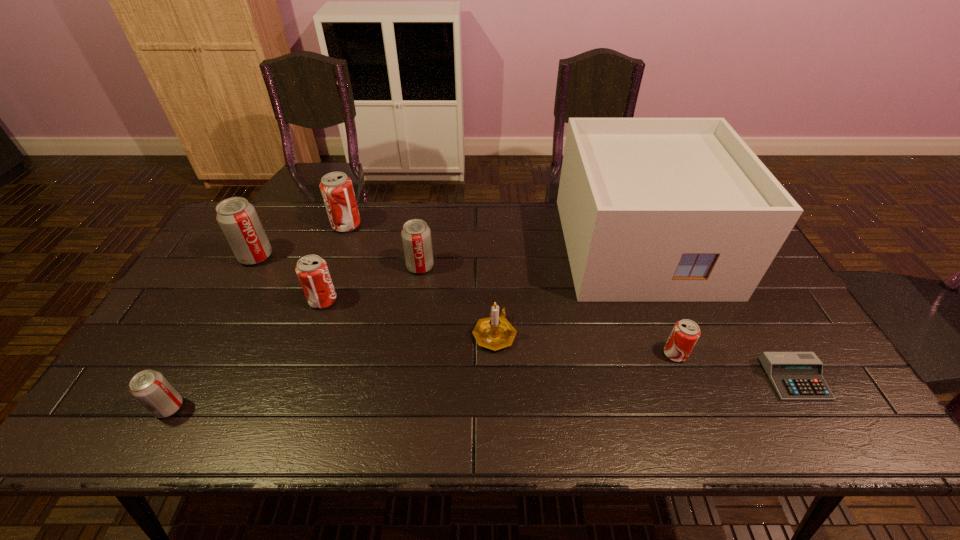
Where is `object that is at the far left corner`? This screenshot has height=540, width=960. object that is at the far left corner is located at coordinates (237, 218).

Identify the location of object that is at the near left corner. (150, 388).

The height and width of the screenshot is (540, 960). What are the coordinates of `object that is at the far right corner` in the screenshot? It's located at (652, 209).

Image resolution: width=960 pixels, height=540 pixels. In the image, there is a desktop. Identify the location of vacant space at the far edge. (388, 205).

What are the coordinates of `free region at the near edge` in the screenshot? It's located at (612, 429).

In the image, there is a desktop. At what (x,y) coordinates should I click in order to perform the action: click on vacant space at the left edge. Please return your answer as a coordinate pair (x, y). Image resolution: width=960 pixels, height=540 pixels. Looking at the image, I should click on (180, 338).

Find the location of a particular element. The width and height of the screenshot is (960, 540). free region at the right edge of the desktop is located at coordinates (768, 309).

Find the location of a particular element. vacant area at the far left corner of the desktop is located at coordinates (228, 245).

At what (x,y) coordinates should I click in order to perform the action: click on free region at the near right corner of the desktop. Please return your answer as a coordinate pair (x, y). Looking at the image, I should click on (825, 443).

Identify the location of vacant point located between the shortest object and the second smallest gray soda can. (608, 322).